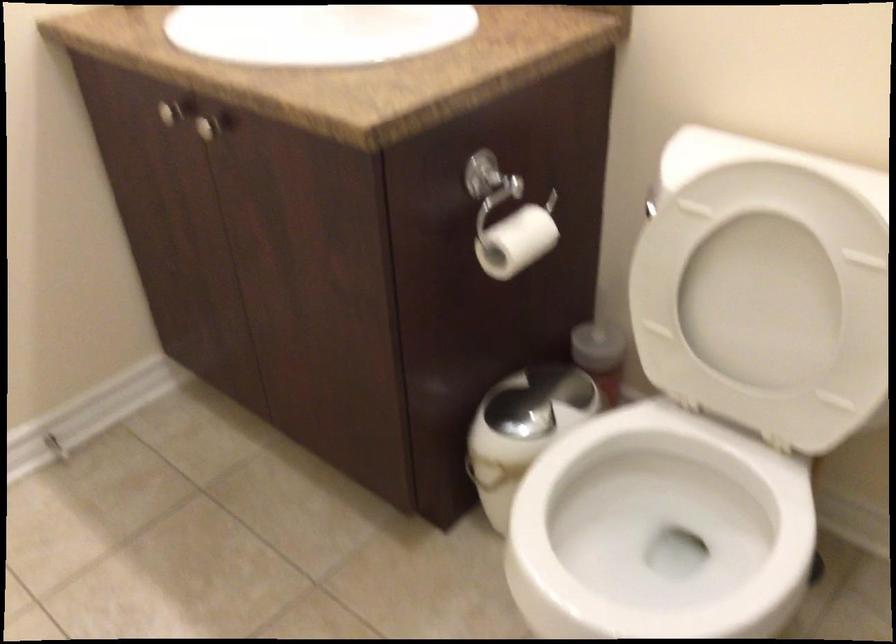
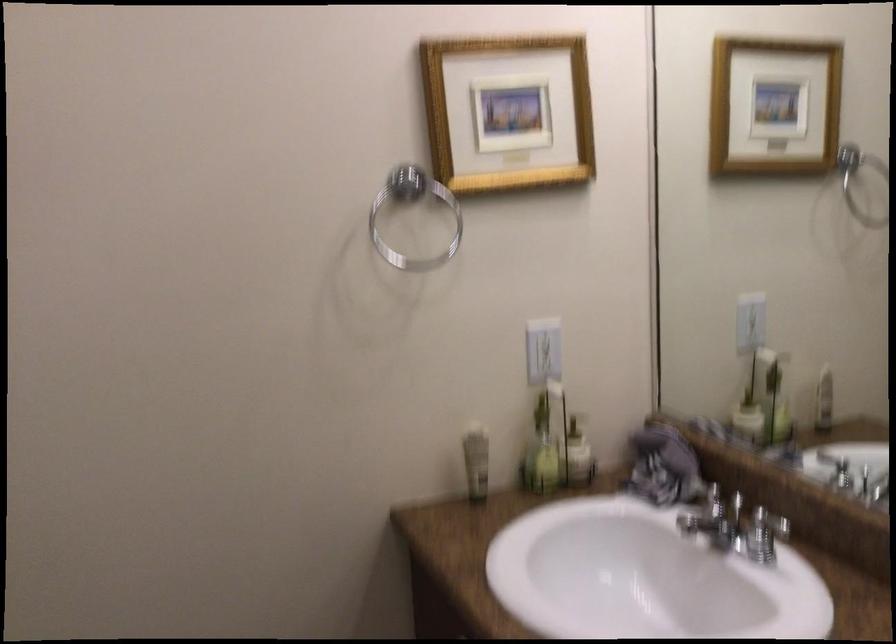
Based on the continuous images, in which direction is the camera rotating?

The camera's rotation is toward left-up.